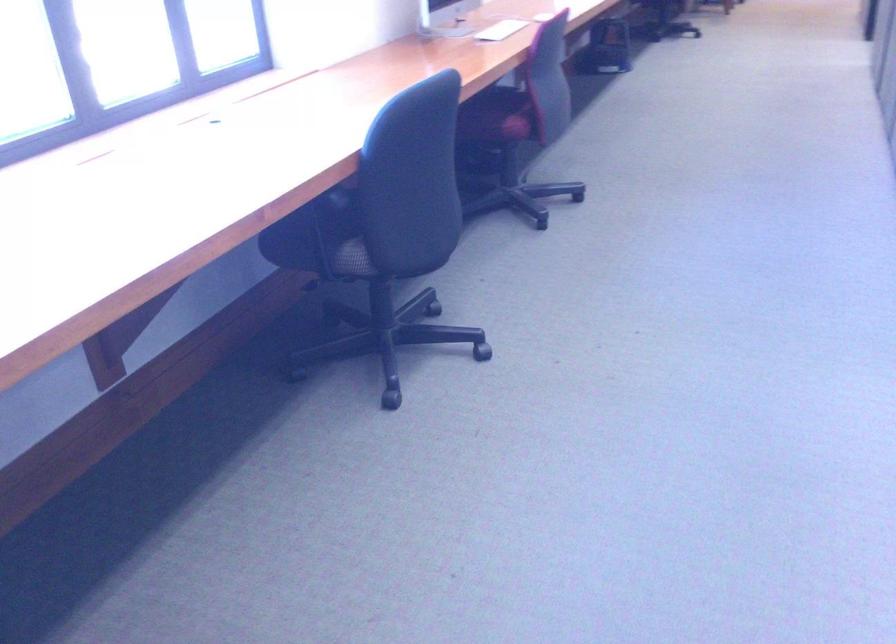
The height and width of the screenshot is (644, 896). What are the coordinates of `white paper` in the screenshot? It's located at (501, 30).